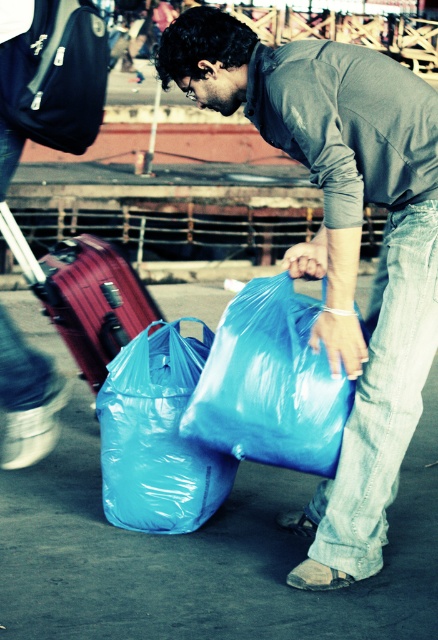
Question: Which of the following is the farthest from the observer?

Choices:
 (A) translucent blue plastic bag at lower center
 (B) matte blue plastic bag at center
 (C) blue plastic bag at center
 (D) jeans at lower right

Answer: (A)

Question: Estimate the real-world distances between objects in this image. Which object is farther from the jeans at lower right?

Choices:
 (A) translucent blue plastic bag at lower center
 (B) matte red suitcase at left
 (C) blue plastic bag at center
 (D) matte blue plastic bag at center

Answer: (B)

Question: Can you confirm if matte blue plastic bag at center is wider than jeans at lower right?

Choices:
 (A) no
 (B) yes

Answer: (B)

Question: Can you confirm if blue plastic bag at center is smaller than matte red suitcase at left?

Choices:
 (A) no
 (B) yes

Answer: (B)

Question: In this image, where is blue plastic bag at center located relative to matte red suitcase at left?

Choices:
 (A) right
 (B) left

Answer: (A)

Question: Which point appears closest to the camera in this image?

Choices:
 (A) (179, 385)
 (B) (229, 305)
 (C) (63, 266)
 (D) (300, 108)

Answer: (D)